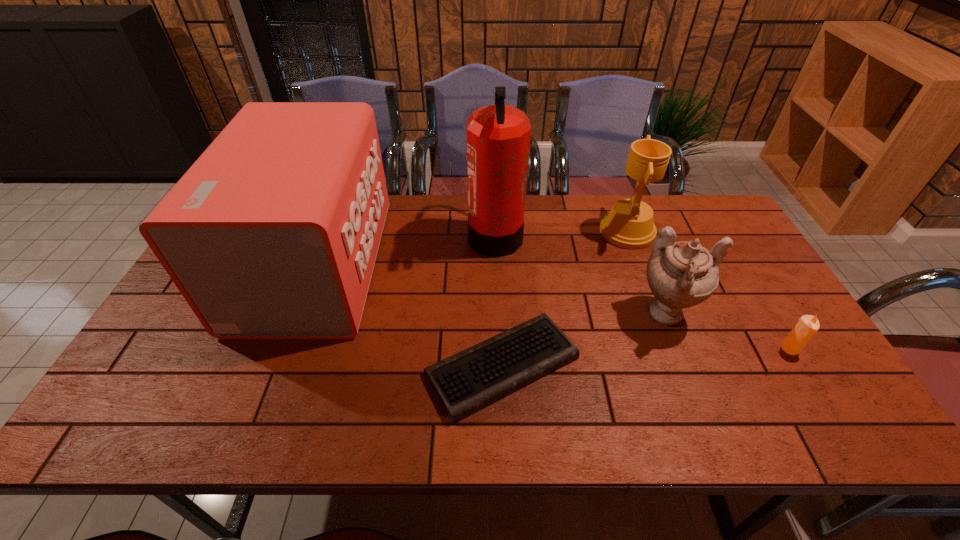
Find the location of a particular element. This screenshot has height=540, width=960. empty location between the fire extinguisher and the award is located at coordinates (561, 233).

This screenshot has width=960, height=540. Find the location of `free space between the box and the award`. free space between the box and the award is located at coordinates (471, 248).

Where is `empty space between the leftmost object and the award`? Image resolution: width=960 pixels, height=540 pixels. empty space between the leftmost object and the award is located at coordinates (471, 248).

In order to click on vacant area between the leftmost object and the second shortest object in this screenshot , I will do `click(552, 307)`.

You are a GUI agent. You are given a task and a screenshot of the screen. Output one action in this format:
    pyautogui.click(x=<x>, y=<y>)
    Task: Click on the free spot between the candle and the computer keyboard
    
    Given the screenshot: What is the action you would take?
    pyautogui.click(x=646, y=357)

Image resolution: width=960 pixels, height=540 pixels. In order to click on vacant space that is in between the fire extinguisher and the urn in this screenshot , I will do click(x=582, y=275).

Locate an element on the screen. Image resolution: width=960 pixels, height=540 pixels. vacant area that lies between the award and the second tallest object is located at coordinates (471, 248).

Where is `vacant space that's between the candle and the computer keyboard`? vacant space that's between the candle and the computer keyboard is located at coordinates (646, 357).

Select which object is the second closest to the urn. Please provide its 2D coordinates. Your answer should be formatted as a tuple, i.e. [(x, y)], where the tuple contains the x and y coordinates of a point satisfying the conditions above.

[(808, 325)]

At what (x,y) coordinates should I click in order to perform the action: click on object that is the closest one to the fire extinguisher. Please return your answer as a coordinate pair (x, y). Looking at the image, I should click on (466, 382).